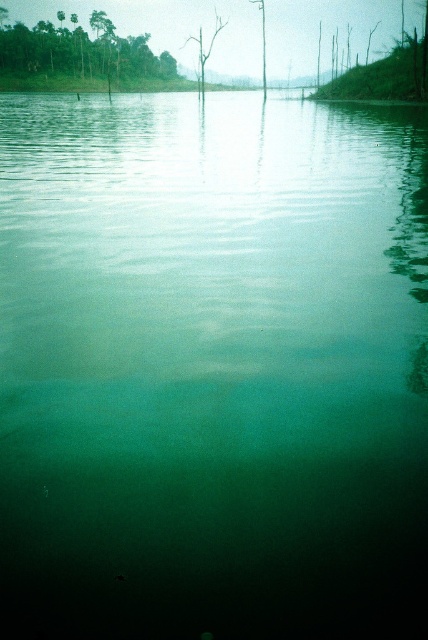
Question: Is green leafy trees at upper left positioned in front of brown wood tree at center?

Choices:
 (A) no
 (B) yes

Answer: (A)

Question: Which object is closer to the camera taking this photo?

Choices:
 (A) brown wood tree at center
 (B) green leafy trees at upper left

Answer: (A)

Question: Which object appears closest to the camera in this image?

Choices:
 (A) brown wood tree at center
 (B) green leafy trees at upper left

Answer: (A)

Question: Which object is closer to the camera taking this photo?

Choices:
 (A) green leafy trees at upper left
 (B) brown wood tree at center

Answer: (B)

Question: Can you confirm if green leafy trees at upper left is bigger than brown wood tree at center?

Choices:
 (A) yes
 (B) no

Answer: (A)

Question: Does green leafy trees at upper left appear on the left side of brown wood tree at center?

Choices:
 (A) no
 (B) yes

Answer: (B)